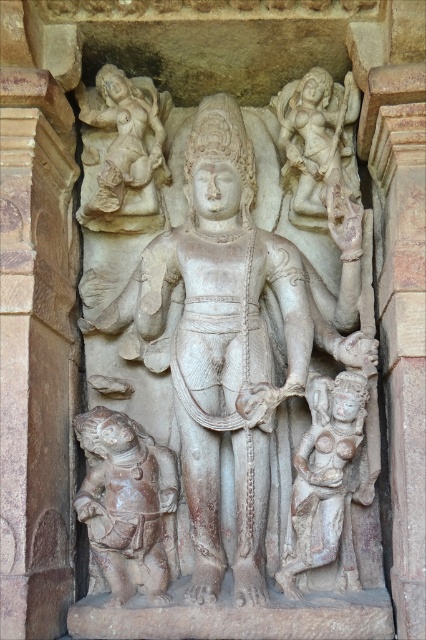
Does brown stone child at lower left have a smaller size compared to white stone figure at lower center?

Actually, brown stone child at lower left might be larger than white stone figure at lower center.

Describe the element at coordinates (126, 500) in the screenshot. I see `brown stone child at lower left` at that location.

At what (x,y) coordinates should I click in order to perform the action: click on brown stone child at lower left. Please return your answer as a coordinate pair (x, y). This screenshot has height=640, width=426. Looking at the image, I should click on (126, 500).

Looking at this image, is white stone statue at center smaller than brown stone child at lower left?

Actually, white stone statue at center might be larger than brown stone child at lower left.

Who is positioned more to the right, white stone statue at center or brown stone child at lower left?

white stone statue at center is more to the right.

Image resolution: width=426 pixels, height=640 pixels. What do you see at coordinates (244, 362) in the screenshot?
I see `white stone statue at center` at bounding box center [244, 362].

Where is `white stone statue at center`? white stone statue at center is located at coordinates (244, 362).

Which is behind, point (244, 550) or point (80, 205)?

The point (80, 205) is behind.

Is white stone statue at center shorter than smooth stone statue at upper left?

In fact, white stone statue at center may be taller than smooth stone statue at upper left.

The height and width of the screenshot is (640, 426). Identify the location of white stone statue at center. (244, 362).

You are a GUI agent. You are given a task and a screenshot of the screen. Output one action in this format:
    pyautogui.click(x=<x>, y=<y>)
    Task: Click on the white stone statue at center
    This screenshot has width=426, height=640.
    Given the screenshot: What is the action you would take?
    pyautogui.click(x=244, y=362)